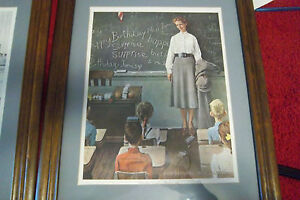
The image size is (300, 200). In order to click on frame in this screenshot , I will do `click(244, 23)`, `click(56, 40)`, `click(36, 38)`.